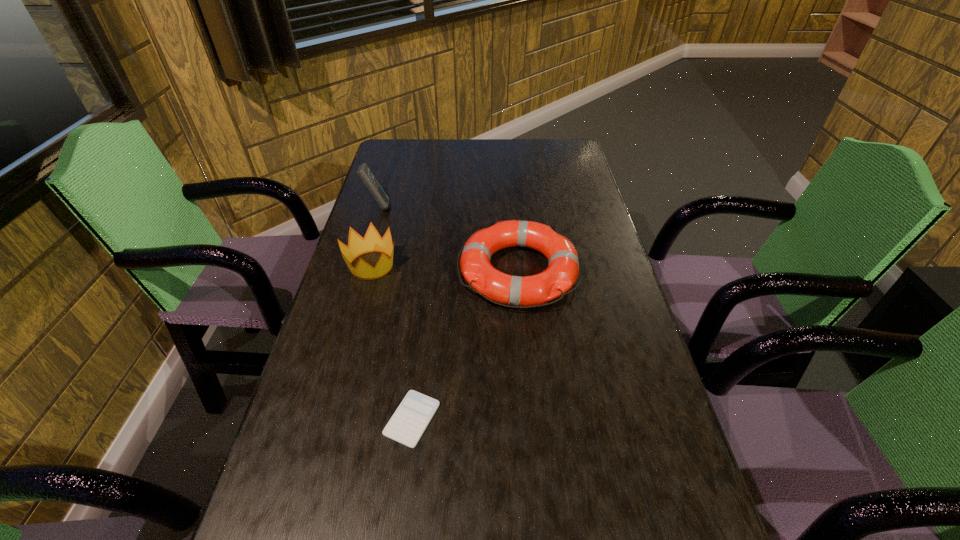
The height and width of the screenshot is (540, 960). In order to click on free spot that satisfies the following two spatial constraints: 1. on the back side of the shorter calculator; 2. on the front-facing side of the left calculator in this screenshot , I will do `click(438, 206)`.

Find the location of a particular element. free space that satisfies the following two spatial constraints: 1. on the front-facing side of the farthest object; 2. on the back side of the nearer calculator is located at coordinates (313, 419).

Where is `vacant space that satisfies the following two spatial constraints: 1. on the front-facing side of the crown; 2. on the right side of the left calculator`? Image resolution: width=960 pixels, height=540 pixels. vacant space that satisfies the following two spatial constraints: 1. on the front-facing side of the crown; 2. on the right side of the left calculator is located at coordinates (359, 265).

The width and height of the screenshot is (960, 540). What are the coordinates of `vacant area in the image that satisfies the following two spatial constraints: 1. on the front-facing side of the taller calculator; 2. on the left side of the shorter calculator` in the screenshot? It's located at (313, 419).

Identify the location of free spot that satisfies the following two spatial constraints: 1. on the front-facing side of the crown; 2. on the left side of the tallest object. The height and width of the screenshot is (540, 960). (359, 265).

I want to click on free spot that satisfies the following two spatial constraints: 1. on the front-facing side of the second object from right to left; 2. on the left side of the left calculator, so 313,419.